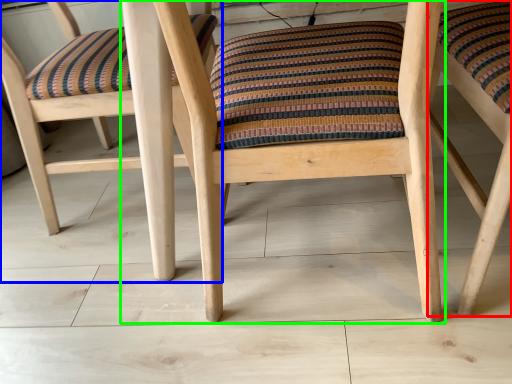
Question: Based on their relative distances, which object is nearer to chair (highlighted by a red box)? Choose from chair (highlighted by a blue box) and chair (highlighted by a green box).

Choices:
 (A) chair
 (B) chair

Answer: (B)